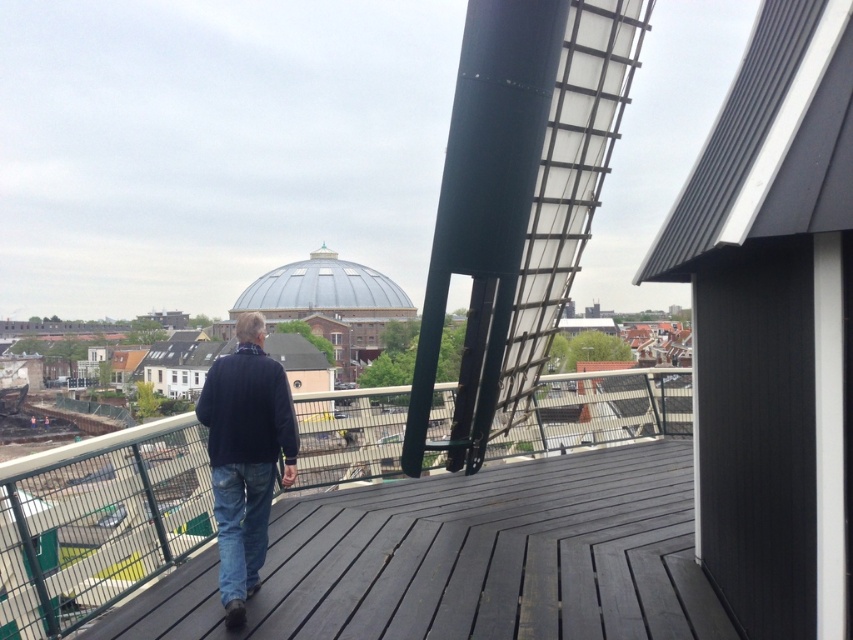
You are standing on the wooden deck of a windmill, looking at two points marked on the deck. The first point is at coordinates point (256, 339) and the second point is at point (227, 476). Which point is closer to the edge of the deck?

Point (227, 476) is closer to the edge of the deck because it is in front of point (256, 339), which is behind it.

You are standing on the rooftop deck and want to take a photo of the metallic silver dome at center and the blue denim jeans at center. Which object should you focus on first if you want to capture both in a single frame without moving the camera?

The metallic silver dome at center is taller than blue denim jeans at center, so you should focus on the metallic silver dome at center first to ensure both are in frame.